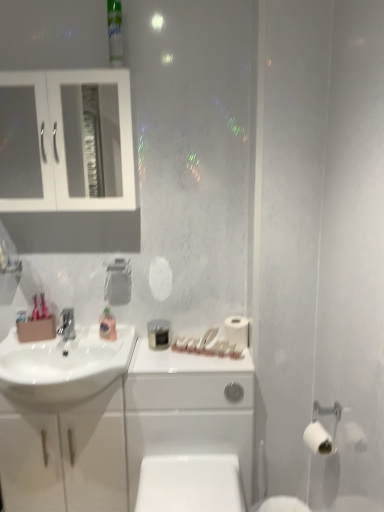
Question: Is white glass cabinet at upper left positioned before green plastic mouthwash at upper center, the 2th mouthwash from the back?

Choices:
 (A) yes
 (B) no

Answer: (B)

Question: Is white glass cabinet at upper left turned away from green plastic mouthwash at upper center, the 2th mouthwash from the back?

Choices:
 (A) yes
 (B) no

Answer: (B)

Question: Is white glass cabinet at upper left taller than green plastic mouthwash at upper center, the 2th mouthwash from the back?

Choices:
 (A) yes
 (B) no

Answer: (A)

Question: Would you say white glass cabinet at upper left is a long distance from green plastic mouthwash at upper center, the second mouthwash in the bottom-to-top sequence?

Choices:
 (A) yes
 (B) no

Answer: (B)

Question: Is white glass cabinet at upper left positioned behind green plastic mouthwash at upper center, the second mouthwash in the left-to-right sequence?

Choices:
 (A) yes
 (B) no

Answer: (A)

Question: Is white glass cabinet at upper left completely or partially outside of green plastic mouthwash at upper center, the second mouthwash in the bottom-to-top sequence?

Choices:
 (A) no
 (B) yes

Answer: (B)

Question: Considering the relative sizes of white matte toilet paper at right, the first toilet paper when ordered from right to left, and white glass cabinet at upper left in the image provided, is white matte toilet paper at right, the first toilet paper when ordered from right to left, thinner than white glass cabinet at upper left?

Choices:
 (A) yes
 (B) no

Answer: (A)

Question: From a real-world perspective, is white matte toilet paper at right, acting as the 2th toilet paper starting from the top, located higher than white glass cabinet at upper left?

Choices:
 (A) yes
 (B) no

Answer: (B)

Question: Is white matte toilet paper at right, which is the 2th toilet paper from left to right, next to white glass cabinet at upper left and touching it?

Choices:
 (A) no
 (B) yes

Answer: (A)

Question: Is the depth of white matte toilet paper at right, arranged as the 1th toilet paper when viewed from the front, less than that of white glass cabinet at upper left?

Choices:
 (A) no
 (B) yes

Answer: (B)

Question: Is white matte toilet paper at right, arranged as the 1th toilet paper when viewed from the front, facing towards white glass cabinet at upper left?

Choices:
 (A) yes
 (B) no

Answer: (B)

Question: Is white glass cabinet at upper left surrounded by white matte toilet paper at right, acting as the 2th toilet paper starting from the top?

Choices:
 (A) no
 (B) yes

Answer: (A)

Question: Is white glossy toilet bowl at lower center positioned behind white matte toilet paper at right, acting as the first toilet paper starting from the back?

Choices:
 (A) yes
 (B) no

Answer: (B)